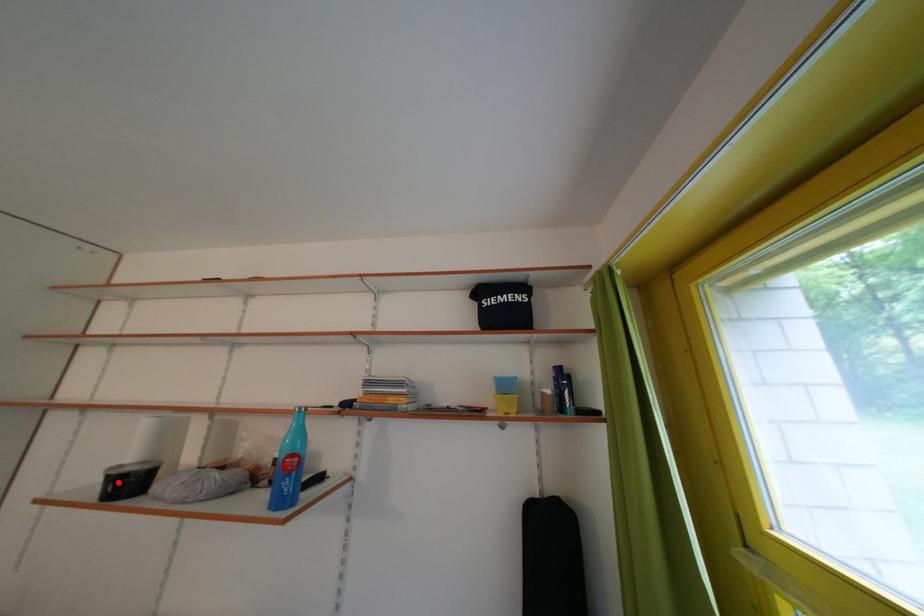
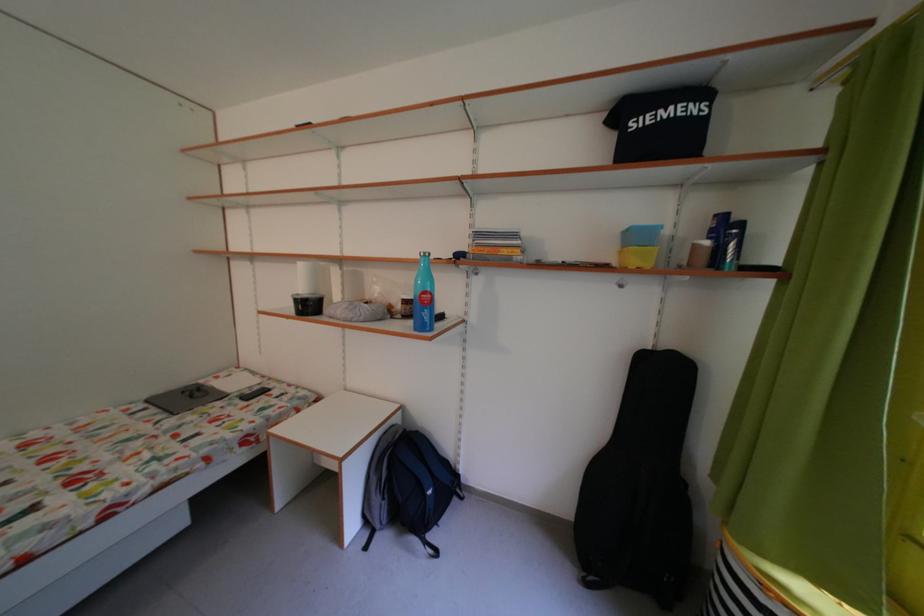
Find the pixel in the second image that matches the highlighted location in the first image.

(306, 306)